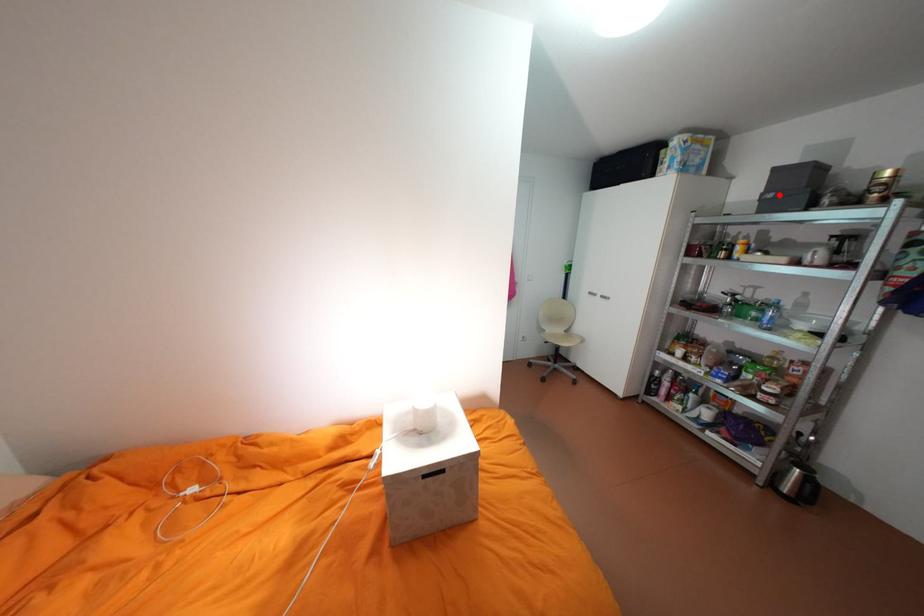
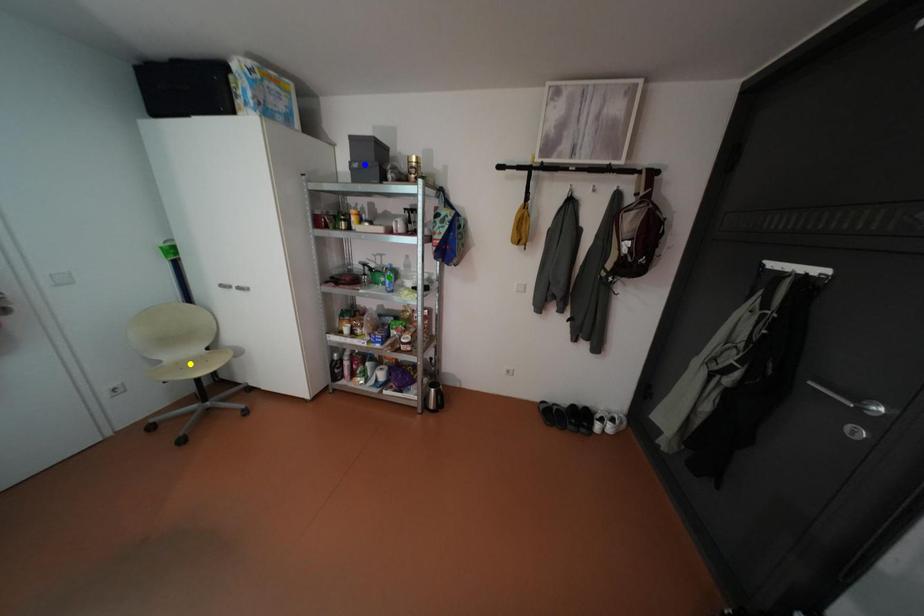
Question: I am providing you with two images of the same scene from different viewpoints. A red point is marked on the first image. You are given multiple points on the second image. Which point in image 2 is actually the same real-world point as the red point in image 1?

Choices:
 (A) yellow point
 (B) green point
 (C) blue point

Answer: (C)